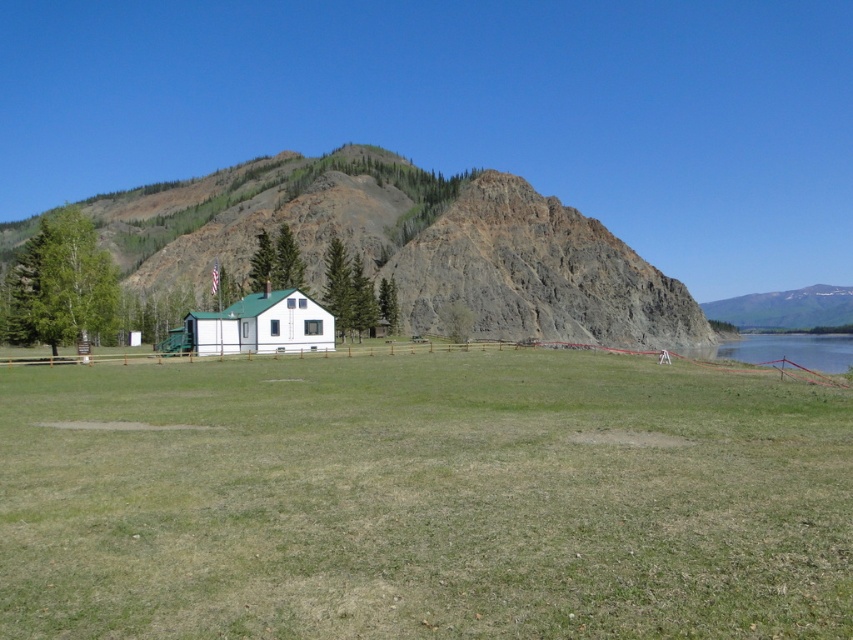
Can you confirm if green grassy field at center is wider than rustic stone mountain at center?

Incorrect, green grassy field at center's width does not surpass rustic stone mountain at center's.

Is point (138, 624) closer to viewer compared to point (119, 208)?

Yes, point (138, 624) is closer to viewer.

The image size is (853, 640). I want to click on green grassy field at center, so click(422, 499).

Can you confirm if green grassy field at center is positioned to the left of white matte cabin at center?

No, green grassy field at center is not to the left of white matte cabin at center.

Is green grassy field at center positioned before white matte cabin at center?

Yes, green grassy field at center is in front of white matte cabin at center.

Is point (383, 460) farther from camera compared to point (322, 308)?

No, it is in front of (322, 308).

Identify the location of green grassy field at center. The image size is (853, 640). (422, 499).

Is rustic stone mountain at center closer to the viewer compared to white matte cabin at center?

No, it is behind white matte cabin at center.

Who is higher up, rustic stone mountain at center or white matte cabin at center?

rustic stone mountain at center is higher up.

Does point (143, 202) come farther from viewer compared to point (200, 312)?

Yes, point (143, 202) is behind point (200, 312).

Identify the location of rustic stone mountain at center. The width and height of the screenshot is (853, 640). (405, 244).